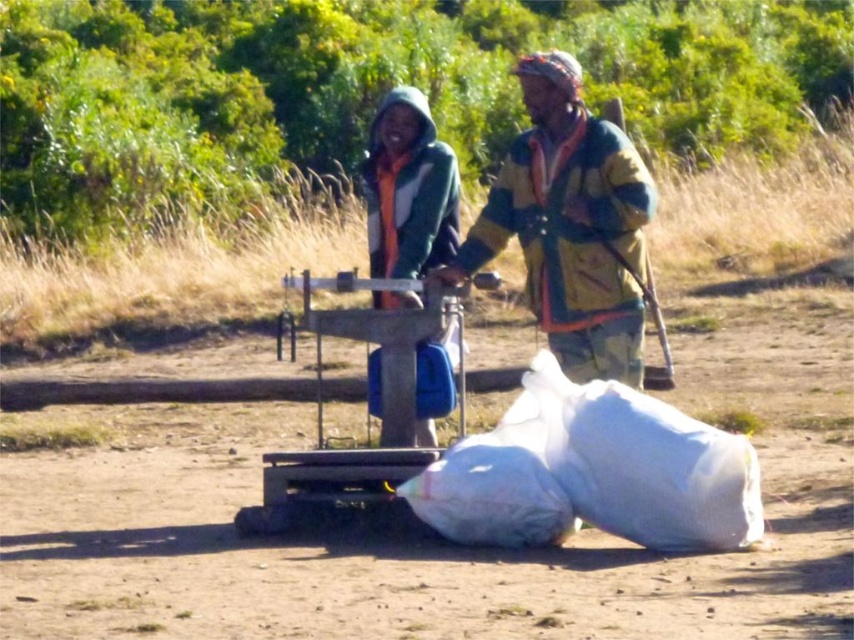
Question: Which object appears farthest from the camera in this image?

Choices:
 (A) white plastic sack at lower right
 (B) green fuzzy jacket at center
 (C) multicolored fabric jacket at center

Answer: (C)

Question: Which object appears farthest from the camera in this image?

Choices:
 (A) green fuzzy jacket at center
 (B) multicolored fabric jacket at center

Answer: (B)

Question: Among these objects, which one is farthest from the camera?

Choices:
 (A) white plastic sack at lower right
 (B) green fuzzy jacket at center

Answer: (B)

Question: Can you confirm if white plastic sack at lower right is positioned above multicolored fabric jacket at center?

Choices:
 (A) yes
 (B) no

Answer: (B)

Question: Can you confirm if white plastic sack at lower right is positioned below multicolored fabric jacket at center?

Choices:
 (A) yes
 (B) no

Answer: (A)

Question: Does white plastic sack at lower right have a smaller size compared to green fuzzy jacket at center?

Choices:
 (A) yes
 (B) no

Answer: (A)